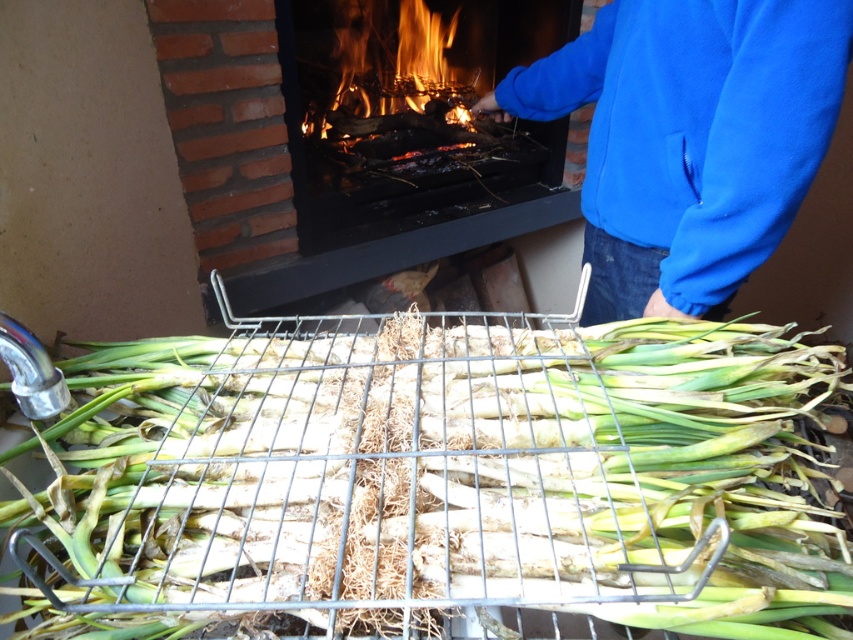
Is green fibrous vegetable at center above blue fleece jacket at upper right?

No, green fibrous vegetable at center is not above blue fleece jacket at upper right.

Does green fibrous vegetable at center appear on the right side of blue fleece jacket at upper right?

No, green fibrous vegetable at center is not to the right of blue fleece jacket at upper right.

This screenshot has width=853, height=640. Identify the location of green fibrous vegetable at center. (448, 477).

Is green fibrous vegetable at center in front of brick fireplace at upper center?

Yes, it is.

Who is more distant from viewer, (737, 397) or (556, 179)?

The point (556, 179) is behind.

Does point (73, 381) come in front of point (213, 202)?

Yes.

Locate an element on the screen. green fibrous vegetable at center is located at coordinates (448, 477).

Which is in front, point (753, 248) or point (260, 112)?

Positioned in front is point (753, 248).

Is blue fleece jacket at upper right smaller than brick fireplace at upper center?

Yes, blue fleece jacket at upper right is smaller than brick fireplace at upper center.

Where is `blue fleece jacket at upper right`? This screenshot has height=640, width=853. blue fleece jacket at upper right is located at coordinates (697, 125).